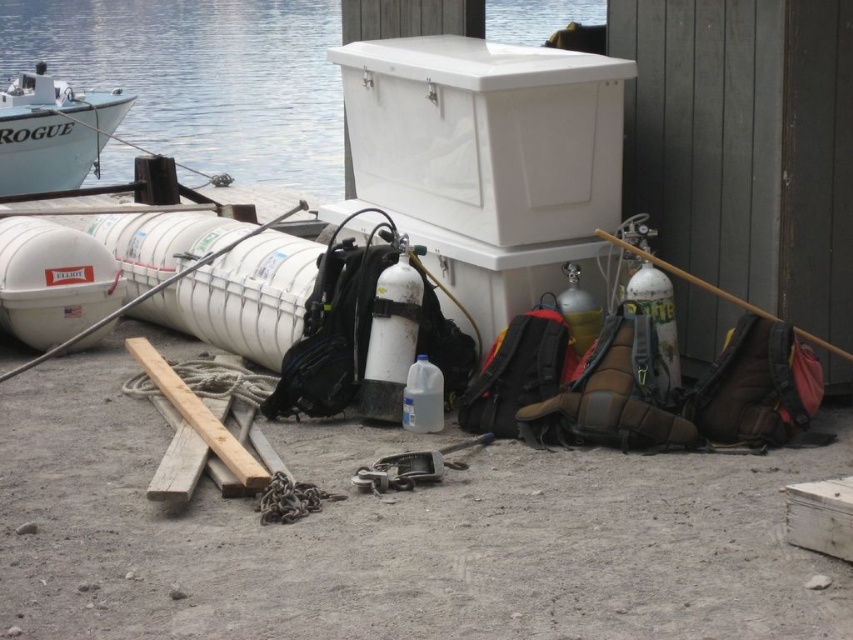
You are a diver preparing to load equipment onto the white inflatable boat named ROGUE. You have the white plastic cooler at upper center and the wooden planks at center. Which item can you place first into the boat if you want to prioritize larger items?

The white plastic cooler at upper center should be placed first into the boat since it has a larger size compared to the wooden planks at center.

You are a diver preparing to board the boat named ROGUE. You need to locate your white plastic cooler at upper center. Based on the coordinates provided, can you determine if the cooler is positioned closer to the dock or the water edge?

The white plastic cooler at upper center is located at coordinates 0.211 on the x and 0.571 on the y axis. Since the dock is positioned along the lower part of the image, the cooler is closer to the dock than the water edge.

You are a diver preparing to enter the water. You see the white glossy water at upper left and the wooden planks at center. Which surface can you step onto to get closer to the water?

The wooden planks at center are lower than the white glossy water at upper left, so you can step onto the wooden planks at center to get closer to the water.